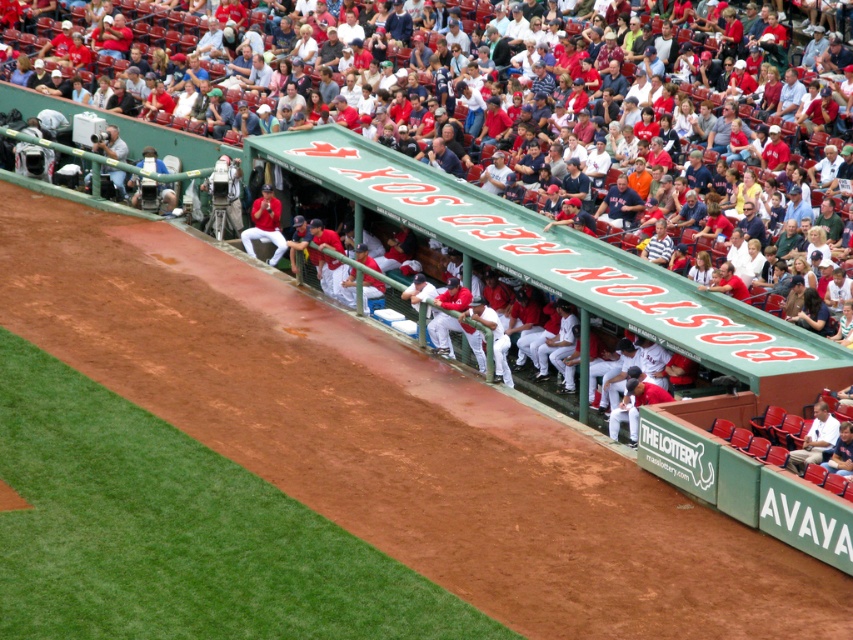
Question: Which of the following is the closest to the observer?

Choices:
 (A) (674, 280)
 (B) (358, 208)

Answer: (A)

Question: Does white plastic seats at upper center appear over red uniformed players at center?

Choices:
 (A) no
 (B) yes

Answer: (B)

Question: Is white plastic seats at upper center to the right of red uniformed players at center from the viewer's perspective?

Choices:
 (A) no
 (B) yes

Answer: (A)

Question: Which point is closer to the camera?

Choices:
 (A) red uniformed players at center
 (B) white plastic seats at upper center

Answer: (B)

Question: Which point is closer to the camera?

Choices:
 (A) white plastic seats at upper center
 (B) red uniformed players at center

Answer: (A)

Question: Does white plastic seats at upper center appear on the left side of red uniformed players at center?

Choices:
 (A) yes
 (B) no

Answer: (A)